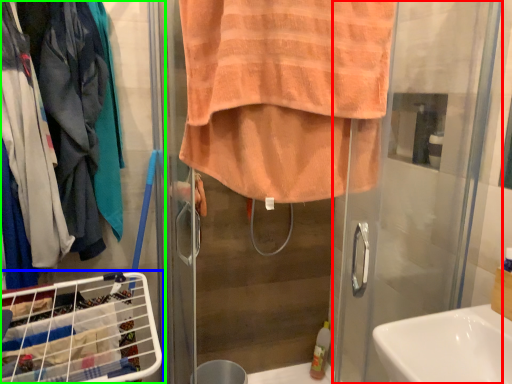
Question: Estimate the real-world distances between objects in this image. Which object is closer to screen door (highlighted by a red box), laundry basket (highlighted by a blue box) or closet (highlighted by a green box)?

Choices:
 (A) laundry basket
 (B) closet

Answer: (B)